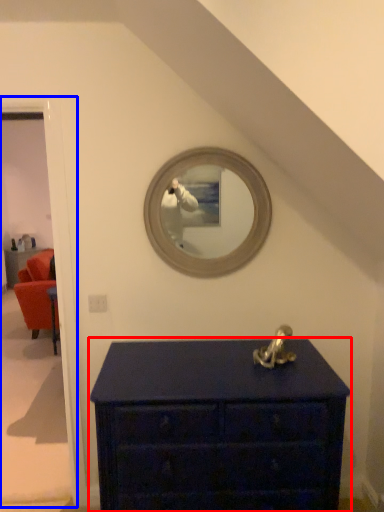
Question: Which object appears farthest to the camera in this image, chest of drawers (highlighted by a red box) or door (highlighted by a blue box)?

Choices:
 (A) chest of drawers
 (B) door

Answer: (B)